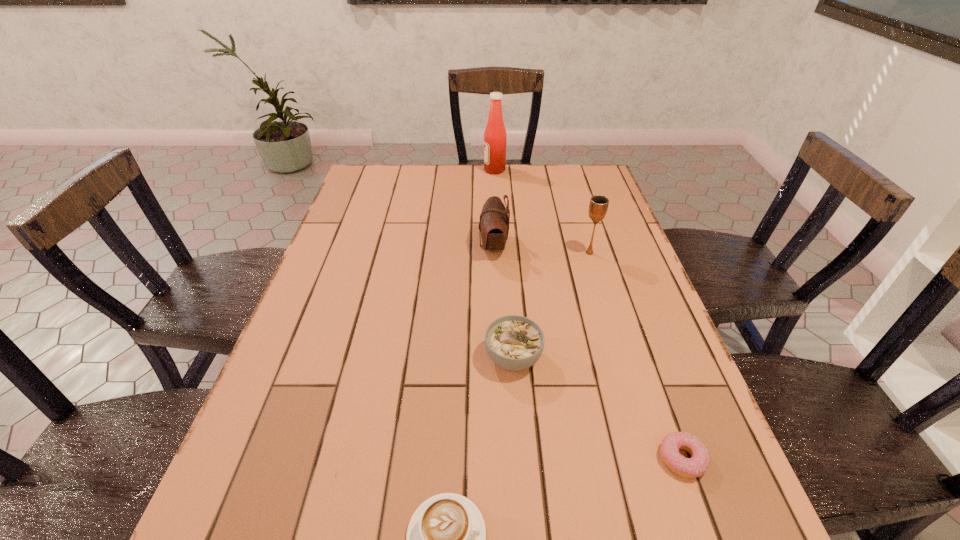
You are a GUI agent. You are given a task and a screenshot of the screen. Output one action in this format:
    pyautogui.click(x=<x>, y=<y>)
    Task: Click on the tallest object
    The height and width of the screenshot is (540, 960).
    Given the screenshot: What is the action you would take?
    pyautogui.click(x=495, y=136)

Where is `the farthest object`? This screenshot has width=960, height=540. the farthest object is located at coordinates (495, 136).

Find the location of a particular element. This screenshot has width=960, height=540. the second tallest object is located at coordinates click(598, 206).

This screenshot has width=960, height=540. In order to click on the third tallest object in this screenshot , I will do `click(494, 220)`.

This screenshot has width=960, height=540. Find the location of `soup bowl`. soup bowl is located at coordinates (513, 342).

Find the location of a particular element. This screenshot has width=960, height=540. the third shortest object is located at coordinates (513, 342).

The width and height of the screenshot is (960, 540). In order to click on the second nearest object in this screenshot , I will do click(x=698, y=464).

Locate an element on the screen. Image resolution: width=960 pixels, height=540 pixels. the shortest object is located at coordinates (698, 464).

Where is `free space located on the front-facing side of the farthest object`? The height and width of the screenshot is (540, 960). free space located on the front-facing side of the farthest object is located at coordinates (442, 170).

Locate an element on the screen. This screenshot has width=960, height=540. blank space located 0.300m on the front-facing side of the farthest object is located at coordinates (400, 170).